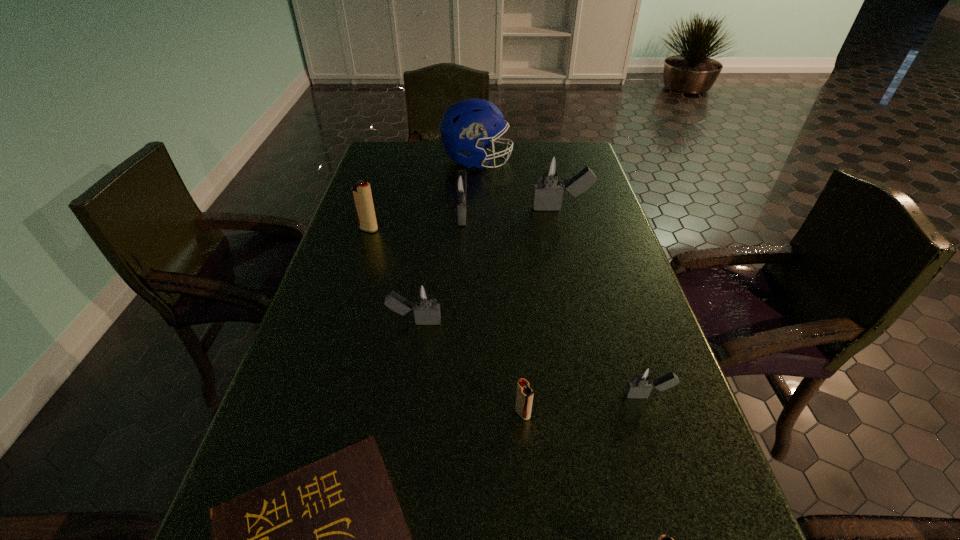
The width and height of the screenshot is (960, 540). In order to click on object that is positioned at the left edge in this screenshot , I will do `click(361, 193)`.

You are a GUI agent. You are given a task and a screenshot of the screen. Output one action in this format:
    pyautogui.click(x=<x>, y=<y>)
    Task: Click on the free space at the left edge
    Image resolution: width=960 pixels, height=540 pixels.
    Given the screenshot: What is the action you would take?
    click(x=376, y=260)

You are a GUI agent. You are given a task and a screenshot of the screen. Output one action in this format:
    pyautogui.click(x=<x>, y=<y>)
    Task: Click on the vacant space at the right edge
    This screenshot has height=540, width=960.
    Given the screenshot: What is the action you would take?
    pyautogui.click(x=604, y=230)

The image size is (960, 540). What are the coordinates of `vacant space at the far left corner of the desktop` in the screenshot? It's located at (376, 141).

In the image, there is a desktop. Where is `vacant space at the far right corner`? This screenshot has width=960, height=540. vacant space at the far right corner is located at coordinates (555, 146).

You are a GUI agent. You are given a task and a screenshot of the screen. Output one action in this format:
    pyautogui.click(x=<x>, y=<y>)
    Task: Click on the free spot between the fifth nearest object and the nearest gray igniter
    
    Given the screenshot: What is the action you would take?
    pyautogui.click(x=532, y=359)

Locate an element on the screen. empty space that is in between the football helmet and the second farthest red igniter is located at coordinates (500, 287).

Find the location of a particular element. vacant space in between the third smallest gray igniter and the leftmost igniter is located at coordinates (416, 221).

The width and height of the screenshot is (960, 540). Identify the location of free spot between the tallest igniter and the fourth farthest igniter. (488, 265).

Where is `vacant space that is in between the second biggest gray igniter and the biggest gray igniter`? The image size is (960, 540). vacant space that is in between the second biggest gray igniter and the biggest gray igniter is located at coordinates (512, 211).